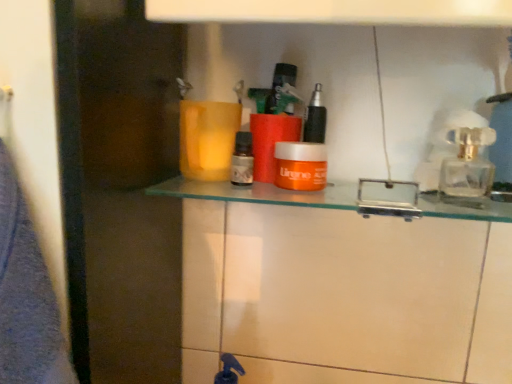
What do you see at coordinates (300, 166) in the screenshot?
I see `orange matte jar at center` at bounding box center [300, 166].

This screenshot has width=512, height=384. What do you see at coordinates (242, 160) in the screenshot?
I see `brown glass bottle at center, the 1th toiletry positioned from the left` at bounding box center [242, 160].

Locate an element on the screen. The height and width of the screenshot is (384, 512). transparent glass perfume bottle at upper right is located at coordinates pyautogui.click(x=467, y=163).

Between transparent glass perfume bottle at upper right and orange matte jar at center, the 1th toiletry in the right-to-left sequence, which one has larger size?

Bigger between the two is transparent glass perfume bottle at upper right.

From the image's perspective, is transparent glass perfume bottle at upper right below orange matte jar at center, the second toiletry positioned from the left?

Yes, from the image's perspective, transparent glass perfume bottle at upper right is below orange matte jar at center, the second toiletry positioned from the left.

Between transparent glass perfume bottle at upper right and orange matte jar at center, the 1th toiletry in the right-to-left sequence, which one is positioned in front?

transparent glass perfume bottle at upper right is in front.

Would you consider transparent glass perfume bottle at upper right to be distant from orange matte jar at center, the second toiletry positioned from the left?

No.

Locate an element on the screen. The image size is (512, 384). glass door lying below the orange matte jar at center (from the image's perspective) is located at coordinates (120, 189).

Is transparent glass door at left wider than orange matte jar at center?

Indeed, transparent glass door at left has a greater width compared to orange matte jar at center.

Which object is closer to the camera, transparent glass door at left or orange matte jar at center?

transparent glass door at left is closer to the camera.

From the image's perspective, is transparent glass door at left located above or below orange matte jar at center?

transparent glass door at left is below orange matte jar at center.

Is transparent glass perfume bottle at upper right positioned with its back to transparent glass door at left?

No, transparent glass door at left is not at the back of transparent glass perfume bottle at upper right.

Where is `soap dispenser on the right of transparent glass door at left`? soap dispenser on the right of transparent glass door at left is located at coordinates (467, 163).

Is transparent glass perfume bottle at upper right with transparent glass door at left?

No, transparent glass perfume bottle at upper right is not touching transparent glass door at left.

Based on their positions, is transparent glass perfume bottle at upper right located to the left or right of transparent glass door at left?

Clearly, transparent glass perfume bottle at upper right is on the right of transparent glass door at left in the image.

How different are the orientations of brown glass bottle at center, the second toiletry positioned from the right, and transparent glass door at left in degrees?

There is a 0.441-degree angle between the facing directions of brown glass bottle at center, the second toiletry positioned from the right, and transparent glass door at left.

Identify the location of glass door on the left of the brown glass bottle at center, the 1th toiletry positioned from the left. This screenshot has width=512, height=384. 120,189.

Which is in front, point (251, 145) or point (89, 202)?

The point (89, 202) is closer to the camera.

Is orange plastic container at center located within orange matte jar at center, the 1th toiletry in the right-to-left sequence?

Actually, orange plastic container at center is outside orange matte jar at center, the 1th toiletry in the right-to-left sequence.

From the image's perspective, which one is positioned lower, orange matte jar at center, the second toiletry positioned from the left, or orange plastic container at center?

orange plastic container at center.

Considering the positions of objects orange matte jar at center, the 1th toiletry in the right-to-left sequence, and orange plastic container at center in the image provided, who is more to the left, orange matte jar at center, the 1th toiletry in the right-to-left sequence, or orange plastic container at center?

From the viewer's perspective, orange matte jar at center, the 1th toiletry in the right-to-left sequence, appears more on the left side.

Would you say transparent glass perfume bottle at upper right is part of transparent glass door at left's contents?

Definitely not — transparent glass perfume bottle at upper right is not inside transparent glass door at left.

From the image's perspective, which one is positioned lower, transparent glass door at left or transparent glass perfume bottle at upper right?

transparent glass door at left is shown below in the image.

Considering the relative positions of transparent glass door at left and transparent glass perfume bottle at upper right in the image provided, is transparent glass door at left in front of transparent glass perfume bottle at upper right?

Yes, transparent glass door at left is closer to the camera.

What's the angular difference between orange plastic container at center and orange matte jar at center's facing directions?

2.64 degrees.

From a real-world perspective, which object stands above the other?

orange matte jar at center is physically above.

Considering the positions of objects orange plastic container at center and orange matte jar at center in the image provided, who is behind, orange plastic container at center or orange matte jar at center?

orange matte jar at center is further from the camera.

Between orange plastic container at center and orange matte jar at center, which one has larger width?

With larger width is orange plastic container at center.

What are the coordinates of `toiletry above the transparent glass perfume bottle at upper right (from a real-world perspective)` in the screenshot? It's located at pyautogui.click(x=315, y=118).

In order to click on glass door directly beneath the orange matte jar at center (from a real-world perspective) in this screenshot , I will do `click(120, 189)`.

Looking at the image, which one is located further to orange matte jar at center, orange plastic container at center or transparent glass perfume bottle at upper right?

transparent glass perfume bottle at upper right is further to orange matte jar at center.

Based on the photo, when comparing their distances from transparent glass door at left, does orange matte jar at center or orange plastic container at center seem further?

orange matte jar at center lies further to transparent glass door at left than the other object.

In the scene shown: Based on their spatial positions, is transparent glass perfume bottle at upper right or orange plastic container at center further from transparent glass door at left?

Based on the image, transparent glass perfume bottle at upper right appears to be further to transparent glass door at left.

Based on their spatial positions, is orange matte jar at center or transparent glass perfume bottle at upper right further from brown glass bottle at center, the 1th toiletry positioned from the left?

The object further to brown glass bottle at center, the 1th toiletry positioned from the left, is transparent glass perfume bottle at upper right.

Estimate the real-world distances between objects in this image. Which object is further from orange matte jar at center, the 1th toiletry in the right-to-left sequence, orange matte jar at center or brown glass bottle at center, the 1th toiletry positioned from the left?

brown glass bottle at center, the 1th toiletry positioned from the left, lies further to orange matte jar at center, the 1th toiletry in the right-to-left sequence, than the other object.

When comparing their distances from orange matte jar at center, the 1th toiletry in the right-to-left sequence, does brown glass bottle at center, the second toiletry positioned from the right, or transparent glass perfume bottle at upper right seem closer?

Based on the image, brown glass bottle at center, the second toiletry positioned from the right, appears to be nearer to orange matte jar at center, the 1th toiletry in the right-to-left sequence.

Looking at the image, which one is located further to orange plastic container at center, transparent glass door at left or transparent glass perfume bottle at upper right?

The object further to orange plastic container at center is transparent glass door at left.

Based on their spatial positions, is orange plastic container at center or transparent glass perfume bottle at upper right closer to transparent glass door at left?

orange plastic container at center is positioned closer to the anchor transparent glass door at left.

At what (x,y) coordinates should I click in order to perform the action: click on shelf located between orange matte jar at center and transparent glass perfume bottle at upper right in the left-right direction. Please return your answer as a coordinate pair (x, y). Looking at the image, I should click on (258, 193).

Where is `toiletry between brown glass bottle at center, the second toiletry positioned from the right, and transparent glass perfume bottle at upper right, in the horizontal direction`? toiletry between brown glass bottle at center, the second toiletry positioned from the right, and transparent glass perfume bottle at upper right, in the horizontal direction is located at coordinates (315, 118).

Image resolution: width=512 pixels, height=384 pixels. In order to click on shelf between transparent glass door at left and transparent glass perfume bottle at upper right from left to right in this screenshot , I will do `click(258, 193)`.

Identify the location of toiletry between orange matte jar at center and transparent glass perfume bottle at upper right in the horizontal direction. This screenshot has width=512, height=384. (315, 118).